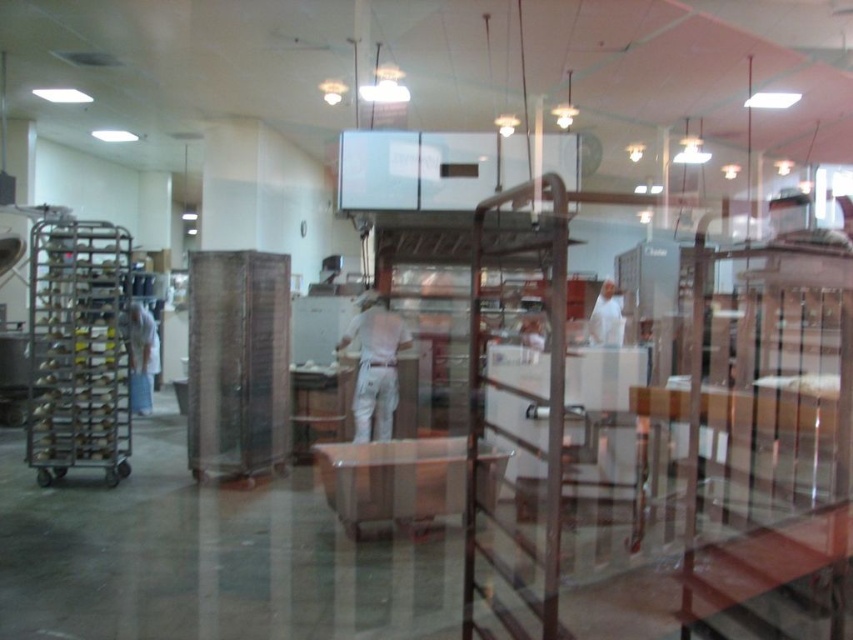
Where is the white fabric shirt at center located in the image?

The white fabric shirt at center is located at point (375, 364) in the image.

You are a safety inspector in the bakery and need to ensure all workers are wearing proper attire. You notice two workers with white fabric shirts. According to the safety guidelines, all shirts must be of uniform size. Based on the image, does the white fabric shirt at center and the white fabric shirt at left meet the size requirement?

The white fabric shirt at center has a larger width than the white fabric shirt at left, so they do not meet the size requirement for uniformity.